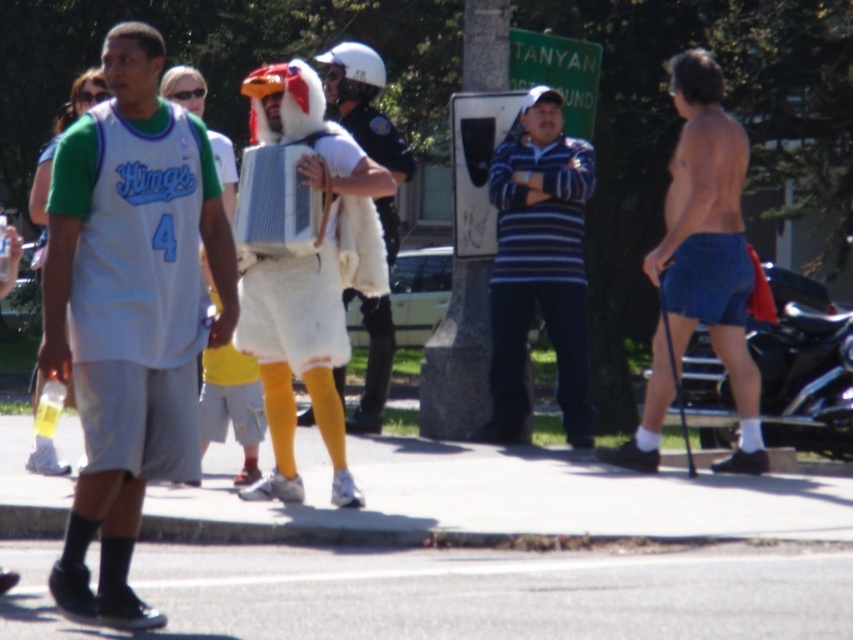
Between point (305, 106) and point (733, 451), which one is positioned in front?

Point (305, 106) is more forward.

Who is lower down, white fluffy costume at center or denim shorts at right?

white fluffy costume at center is lower down.

Which is behind, point (250, 108) or point (654, 381)?

Point (250, 108)

Where is `white fluffy costume at center`? white fluffy costume at center is located at coordinates (303, 280).

Between denim shorts at right and blue striped shirt at center, which one has more height?

blue striped shirt at center is taller.

Does denim shorts at right have a larger size compared to blue striped shirt at center?

No, denim shorts at right is not bigger than blue striped shirt at center.

Is point (685, 104) less distant than point (582, 216)?

Yes, point (685, 104) is closer to viewer.

Where is `denim shorts at right`? denim shorts at right is located at coordinates (700, 266).

Is denim shorts at right shorter than fuzzy white costume at center?

Yes, denim shorts at right is shorter than fuzzy white costume at center.

Does denim shorts at right appear on the left side of fuzzy white costume at center?

Incorrect, denim shorts at right is not on the left side of fuzzy white costume at center.

Who is more forward, (695, 241) or (335, 58)?

Point (695, 241) is in front.

Where is `denim shorts at right`? This screenshot has height=640, width=853. denim shorts at right is located at coordinates [x=700, y=266].